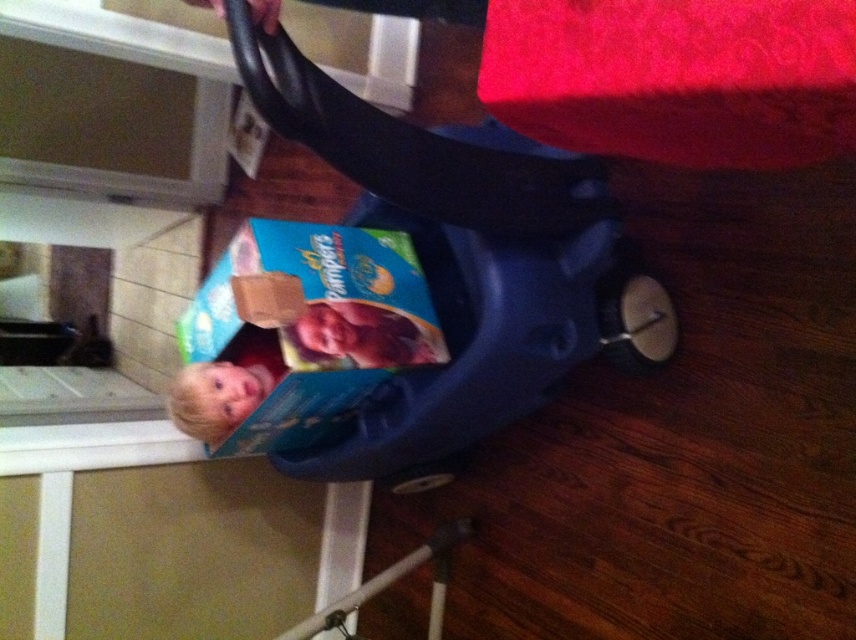
Question: Which object is positioned closest to the blonde hair baby at lower left?

Choices:
 (A) blue plastic baby carriage at center
 (B) smooth plastic baby at center

Answer: (B)

Question: Does blue plastic baby carriage at center have a smaller size compared to blonde hair baby at lower left?

Choices:
 (A) no
 (B) yes

Answer: (A)

Question: Which is nearer to the smooth plastic baby at center?

Choices:
 (A) blue plastic baby carriage at center
 (B) blonde hair baby at lower left

Answer: (B)

Question: Can you confirm if blue plastic baby carriage at center is positioned below smooth plastic baby at center?

Choices:
 (A) yes
 (B) no

Answer: (B)

Question: In this image, where is smooth plastic baby at center located relative to blonde hair baby at lower left?

Choices:
 (A) below
 (B) above

Answer: (B)

Question: Which of the following is the farthest from the observer?

Choices:
 (A) (441, 141)
 (B) (308, 326)

Answer: (B)